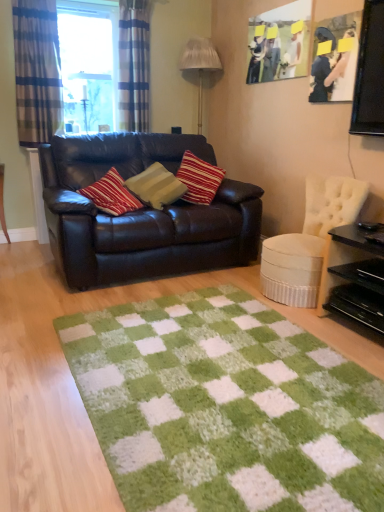
This screenshot has height=512, width=384. I want to click on free spot above green shaggy rug at center (from a real-world perspective), so click(215, 378).